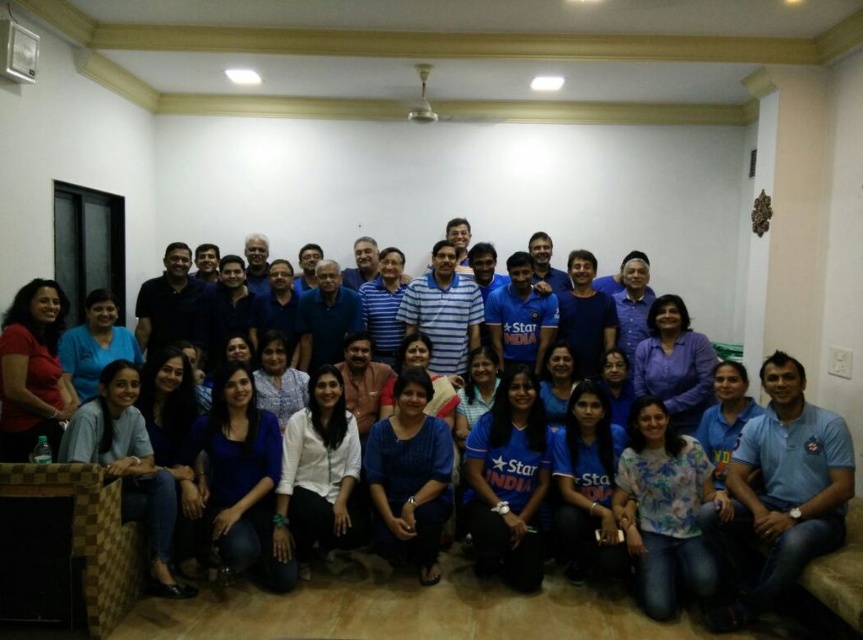
Question: Can you confirm if blue cotton shirt at center is bigger than blue cotton polo shirt at lower right?

Choices:
 (A) yes
 (B) no

Answer: (B)

Question: Based on their relative distances, which object is nearer to the matte red shirt at left?

Choices:
 (A) blue cotton polo shirt at lower right
 (B) blue cotton shirt at center

Answer: (B)

Question: Is blue cotton shirt at center closer to the viewer compared to matte red shirt at left?

Choices:
 (A) no
 (B) yes

Answer: (B)

Question: Based on their relative distances, which object is nearer to the blue cotton polo shirt at lower right?

Choices:
 (A) matte red shirt at left
 (B) blue cotton shirt at center

Answer: (B)

Question: Considering the relative positions of blue cotton shirt at center and matte red shirt at left in the image provided, where is blue cotton shirt at center located with respect to matte red shirt at left?

Choices:
 (A) below
 (B) above

Answer: (A)

Question: Which object appears closest to the camera in this image?

Choices:
 (A) blue cotton polo shirt at lower right
 (B) matte red shirt at left
 (C) blue cotton shirt at center

Answer: (C)